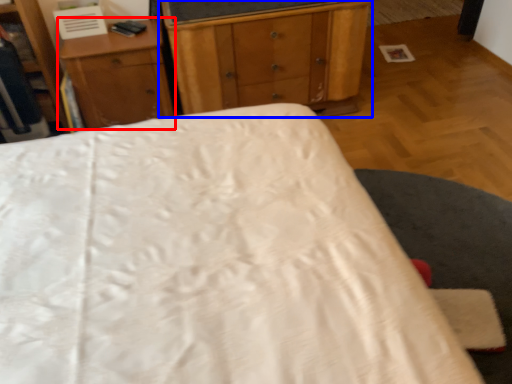
Question: Which object appears closest to the camera in this image, nightstand (highlighted by a red box) or chest of drawers (highlighted by a blue box)?

Choices:
 (A) nightstand
 (B) chest of drawers

Answer: (B)